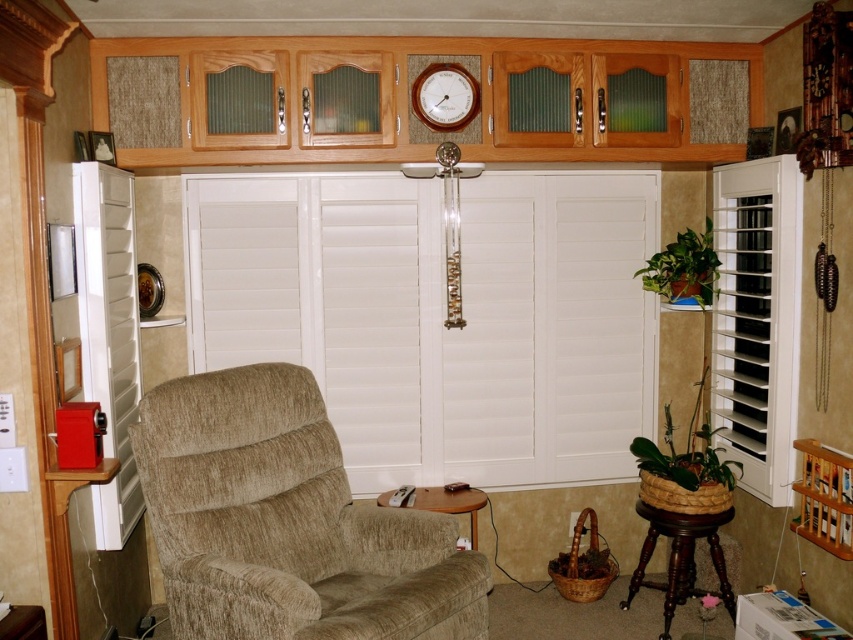
Question: Can you confirm if white wood blinds at right is thinner than matte silver clock at upper center?

Choices:
 (A) no
 (B) yes

Answer: (B)

Question: Which point appears farthest from the camera in this image?

Choices:
 (A) (773, 442)
 (B) (379, 348)

Answer: (B)

Question: Does beige chenille armchair at center have a greater width compared to matte silver clock at upper center?

Choices:
 (A) no
 (B) yes

Answer: (B)

Question: Which object appears closest to the camera in this image?

Choices:
 (A) white wood blinds at center
 (B) beige chenille armchair at center
 (C) white wood blinds at right

Answer: (B)

Question: Does brown wooden stool at lower right appear under matte silver clock at upper center?

Choices:
 (A) yes
 (B) no

Answer: (A)

Question: Which point appears closest to the camera in this image?

Choices:
 (A) (231, 627)
 (B) (778, 448)
 (C) (474, 186)

Answer: (A)